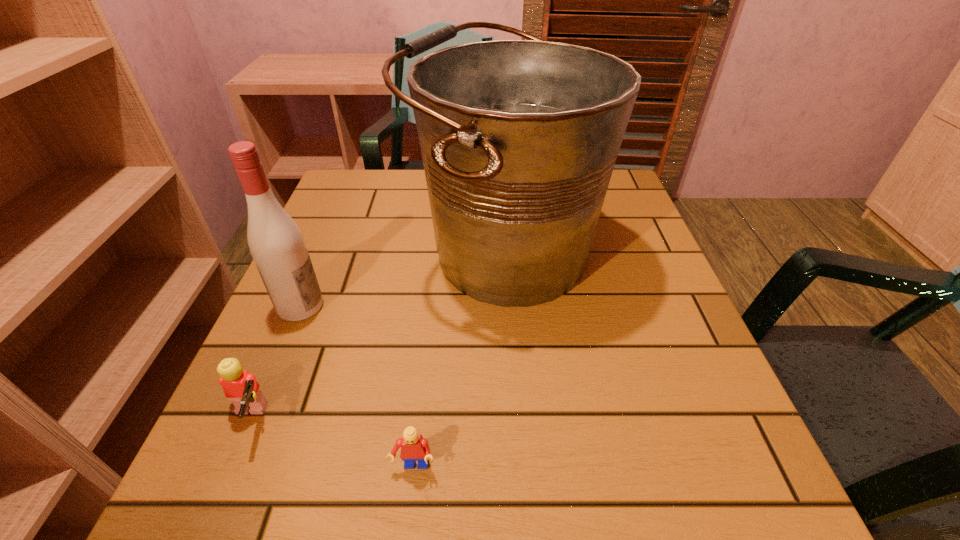
The image size is (960, 540). Identify the location of object at the far edge. click(x=519, y=138).

Locate an element on the screen. This screenshot has height=540, width=960. object that is positioned at the near edge is located at coordinates (414, 447).

The width and height of the screenshot is (960, 540). I want to click on alcohol that is at the left edge, so click(276, 243).

What are the coordinates of `Lego present at the left edge` in the screenshot? It's located at (240, 386).

Identify the location of object located in the right edge section of the desktop. pyautogui.click(x=519, y=138).

What are the coordinates of `object that is positioned at the far right corner` in the screenshot? It's located at (519, 138).

In the image, there is a desktop. Where is `free space at the far edge`? The image size is (960, 540). free space at the far edge is located at coordinates (428, 216).

At what (x,y) coordinates should I click in order to perform the action: click on free space at the left edge of the desktop. Please return your answer as a coordinate pair (x, y). Image resolution: width=960 pixels, height=540 pixels. Looking at the image, I should click on (360, 320).

In order to click on blank space at the right edge of the desktop in this screenshot , I will do `click(653, 411)`.

This screenshot has width=960, height=540. I want to click on vacant space at the far left corner of the desktop, so click(390, 209).